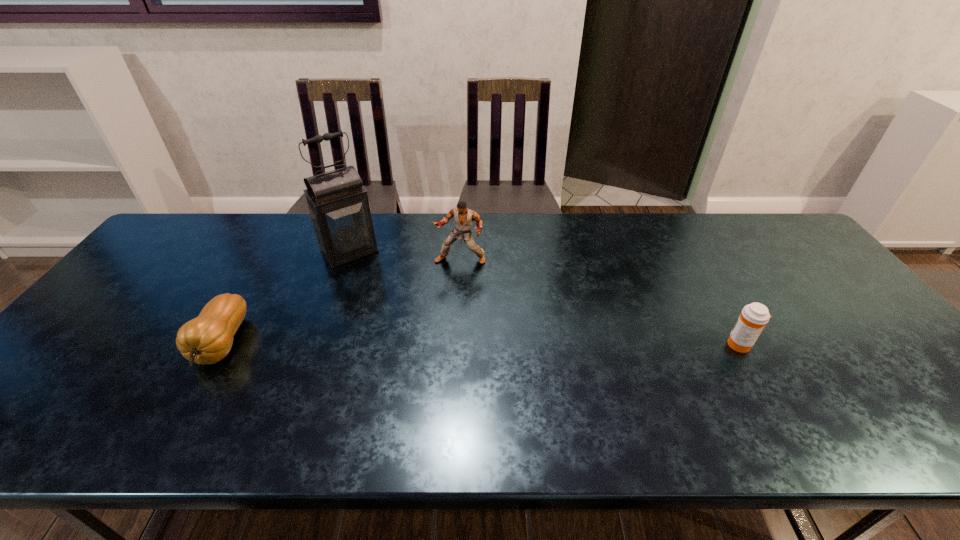
Image resolution: width=960 pixels, height=540 pixels. In the image, there is a desktop. What are the coordinates of `free space at the far right corner` in the screenshot? It's located at (802, 245).

Identify the location of empty location between the second tallest object and the leftmost object. This screenshot has width=960, height=540. (341, 301).

At what (x,y) coordinates should I click in order to perform the action: click on vacant area between the rightmost object and the second object from left to right. Please return your answer as a coordinate pair (x, y). This screenshot has width=960, height=540. Looking at the image, I should click on (545, 298).

The image size is (960, 540). I want to click on free space between the medicine and the gourd, so click(x=481, y=344).

What are the coordinates of `blank region between the leftmost object and the tallest object` in the screenshot? It's located at (286, 297).

Image resolution: width=960 pixels, height=540 pixels. I want to click on empty space between the tallest object and the second object from right to left, so click(x=405, y=255).

I want to click on free space between the medicine and the third object from right to left, so click(545, 298).

This screenshot has width=960, height=540. In order to click on vacant space that is in between the medicine and the gourd in this screenshot , I will do `click(481, 344)`.

Find the location of `vacant space that's between the medicine and the leftmost object`. vacant space that's between the medicine and the leftmost object is located at coordinates (481, 344).

Locate an element on the screen. This screenshot has height=540, width=960. empty location between the puncher and the leftmost object is located at coordinates (341, 301).